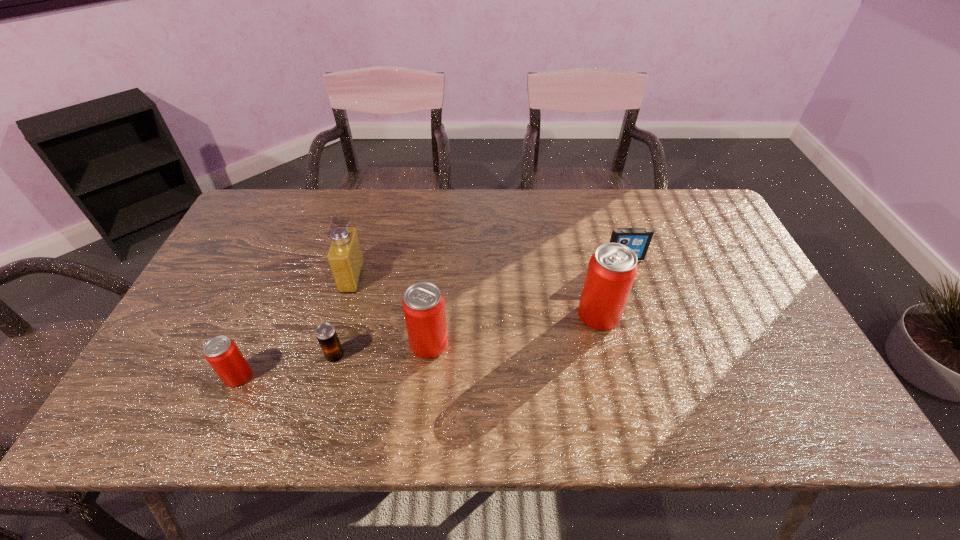
This screenshot has width=960, height=540. Identify the location of the leftmost can. (222, 353).

You are a GUI agent. You are given a task and a screenshot of the screen. Output one action in this format:
    pyautogui.click(x=<x>, y=<y>)
    Task: Click on the leftmost object
    The height and width of the screenshot is (540, 960).
    Given the screenshot: What is the action you would take?
    pyautogui.click(x=222, y=353)

Locate an element on the screen. The width and height of the screenshot is (960, 540). the fourth object from left to right is located at coordinates (423, 304).

Where is `the second can from right to left`? The width and height of the screenshot is (960, 540). the second can from right to left is located at coordinates (423, 304).

This screenshot has width=960, height=540. Identify the location of the rightmost can. (611, 271).

I want to click on the second farthest object, so click(345, 257).

Identify the location of iPod. The height and width of the screenshot is (540, 960). (638, 239).

Find the location of `the farthest object`. the farthest object is located at coordinates (638, 239).

Where is `beer can`? beer can is located at coordinates (326, 334).

Identify the location of free space located on the back of the nearest object. The height and width of the screenshot is (540, 960). (270, 303).